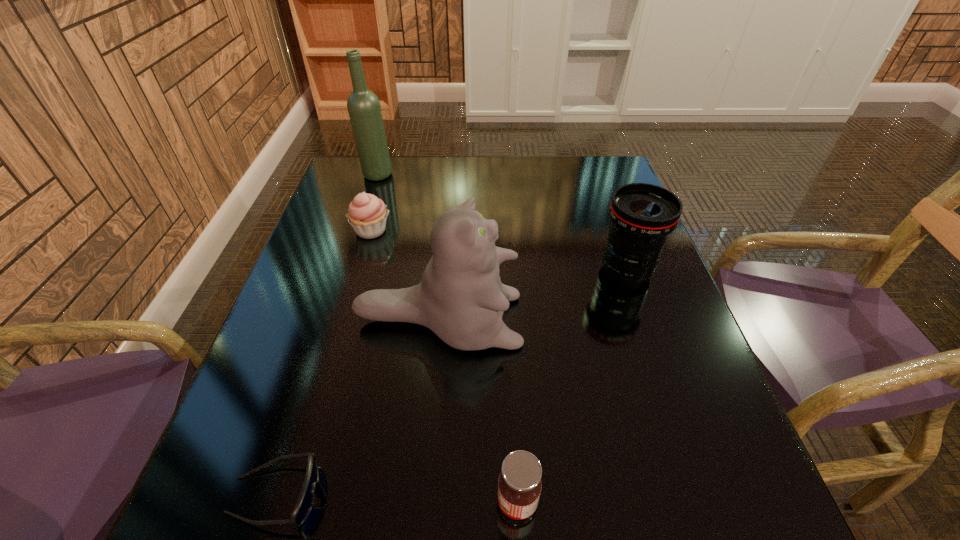
Identify the location of free space located on the back of the third tallest object. The height and width of the screenshot is (540, 960). (603, 203).

Locate an element on the screen. vacant space situated 0.110m on the back of the cupcake is located at coordinates (381, 195).

Where is `blank area located 0.190m on the label side of the jam`? The image size is (960, 540). blank area located 0.190m on the label side of the jam is located at coordinates (372, 502).

This screenshot has width=960, height=540. What are the coordinates of `free space located 0.080m on the label side of the jam` in the screenshot? It's located at pos(444,502).

Locate an element on the screen. free region located on the label side of the jam is located at coordinates (365, 502).

Find the location of a particular element. Image resolution: width=960 pixels, height=540 pixels. vacant region located 0.240m on the front-facing side of the shortest object is located at coordinates (477, 495).

Locate an element on the screen. object that is at the far edge is located at coordinates (364, 109).

Where is `jam present at the near edge`? The width and height of the screenshot is (960, 540). jam present at the near edge is located at coordinates point(519,483).

This screenshot has height=540, width=960. What are the coordinates of `sunglasses that is at the near edge` in the screenshot? It's located at (306, 498).

Where is `wine bottle at the left edge`? wine bottle at the left edge is located at coordinates (364, 109).